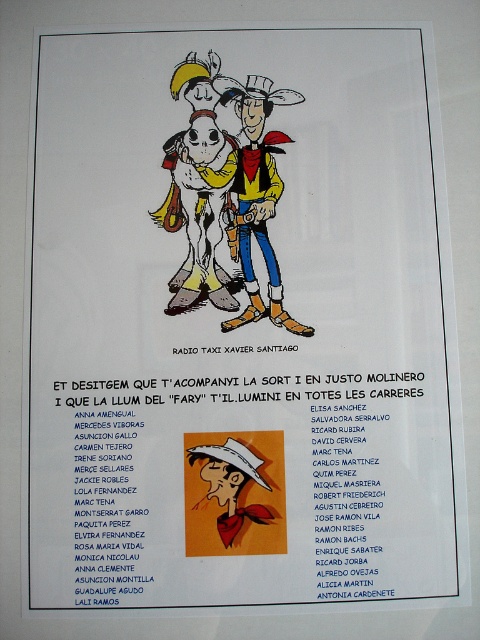
Question: Which of the following is the closest to the observer?

Choices:
 (A) (176, 204)
 (B) (215, 448)
 (C) (187, 493)

Answer: (C)

Question: Among these objects, which one is nearest to the camera?

Choices:
 (A) matte yellow cowboy hat at upper center
 (B) matte yellow cowboy at center
 (C) white matte cowboy hat at center

Answer: (C)

Question: Does matte orange cowboy at center appear on the left side of white matte cowboy hat at center?

Choices:
 (A) yes
 (B) no

Answer: (A)

Question: Which of these objects is positioned closest to the matte yellow cowboy hat at upper center?

Choices:
 (A) matte orange cowboy at center
 (B) white matte cowboy hat at center
 (C) matte yellow cowboy at center

Answer: (C)

Question: Does matte yellow cowboy at center have a lesser width compared to white matte cowboy hat at center?

Choices:
 (A) yes
 (B) no

Answer: (B)

Question: Is matte yellow cowboy at center below white matte cowboy hat at center?

Choices:
 (A) yes
 (B) no

Answer: (B)